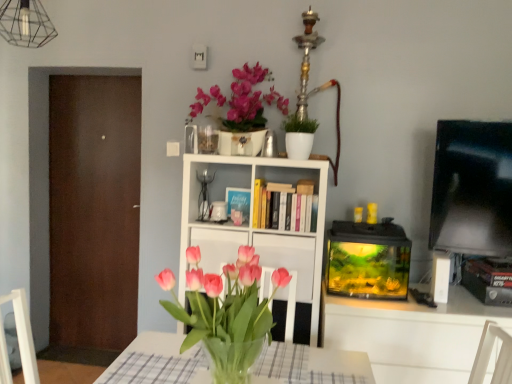
Question: Is brown matte door at left taller than white glossy cabinet at center?

Choices:
 (A) no
 (B) yes

Answer: (B)

Question: From the image's perspective, does brown matte door at left appear lower than white glossy cabinet at center?

Choices:
 (A) yes
 (B) no

Answer: (B)

Question: Considering the relative sizes of brown matte door at left and white glossy cabinet at center in the image provided, is brown matte door at left shorter than white glossy cabinet at center?

Choices:
 (A) yes
 (B) no

Answer: (B)

Question: Considering the relative positions of brown matte door at left and white glossy cabinet at center in the image provided, is brown matte door at left to the left of white glossy cabinet at center from the viewer's perspective?

Choices:
 (A) no
 (B) yes

Answer: (B)

Question: Is brown matte door at left facing away from white glossy cabinet at center?

Choices:
 (A) yes
 (B) no

Answer: (B)

Question: Considering the positions of white glossy mug at center and matte ceramic vase at upper center in the image, is white glossy mug at center taller or shorter than matte ceramic vase at upper center?

Choices:
 (A) short
 (B) tall

Answer: (A)

Question: Would you say white glossy mug at center is to the left or to the right of matte ceramic vase at upper center in the picture?

Choices:
 (A) left
 (B) right

Answer: (A)

Question: Looking at their shapes, would you say white glossy mug at center is wider or thinner than matte ceramic vase at upper center?

Choices:
 (A) wide
 (B) thin

Answer: (B)

Question: Relative to matte ceramic vase at upper center, is white glossy mug at center in front or behind?

Choices:
 (A) behind
 (B) front

Answer: (A)

Question: Considering the positions of point (294, 258) and point (208, 97), is point (294, 258) closer or farther from the camera than point (208, 97)?

Choices:
 (A) closer
 (B) farther

Answer: (A)

Question: From the image's perspective, is white glossy cabinet at center positioned above or below matte ceramic vase at upper center?

Choices:
 (A) above
 (B) below

Answer: (B)

Question: Considering their positions, is white glossy cabinet at center located in front of or behind matte ceramic vase at upper center?

Choices:
 (A) front
 (B) behind

Answer: (A)

Question: Is white glossy cabinet at center inside the boundaries of matte ceramic vase at upper center, or outside?

Choices:
 (A) inside
 (B) outside

Answer: (B)

Question: Is white glossy cabinet at center in front of or behind white matte bookcase at center in the image?

Choices:
 (A) front
 (B) behind

Answer: (A)

Question: From a real-world perspective, relative to white matte bookcase at center, is white glossy cabinet at center vertically above or below?

Choices:
 (A) below
 (B) above

Answer: (A)